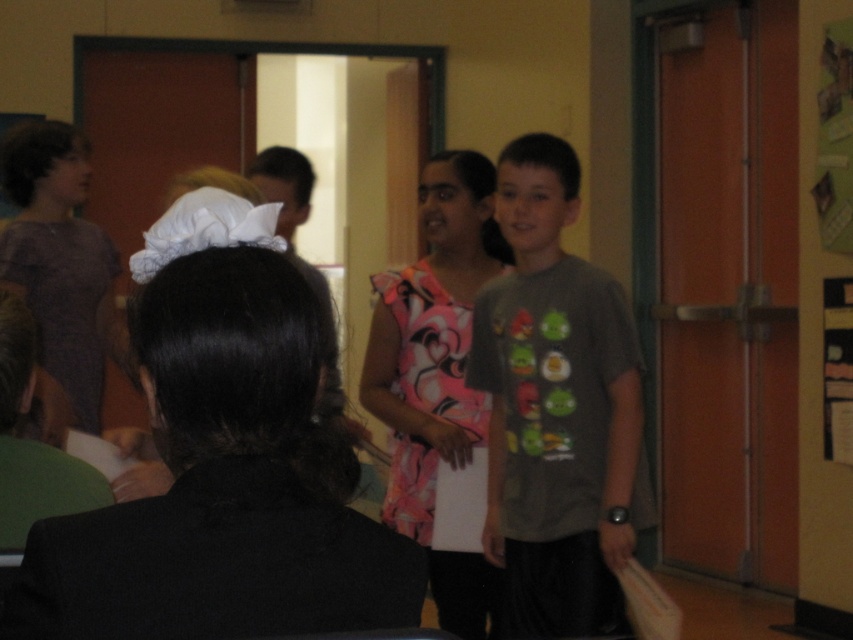
Does dark gray t-shirt at center have a larger size compared to floral fabric dress at center?

No.

Can you confirm if dark gray t-shirt at center is shorter than floral fabric dress at center?

Indeed, dark gray t-shirt at center has a lesser height compared to floral fabric dress at center.

This screenshot has width=853, height=640. I want to click on dark gray t-shirt at center, so click(556, 410).